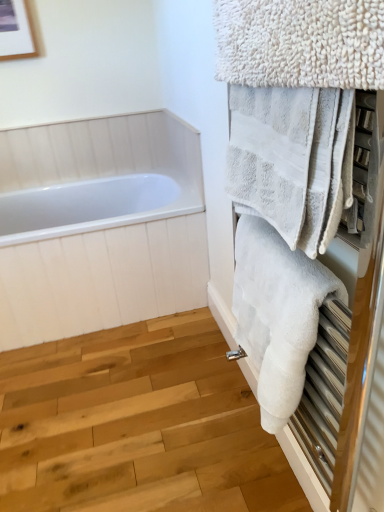
Question: From their relative heights in the image, would you say white fluffy towel at upper right, marked as the third towel in a bottom-to-top arrangement, is taller or shorter than white fluffy towel at right, placed as the 1th towel when sorted from bottom to top?

Choices:
 (A) short
 (B) tall

Answer: (A)

Question: Is white fluffy towel at upper right, marked as the third towel in a bottom-to-top arrangement, wider or thinner than white fluffy towel at right, placed as the 1th towel when sorted from bottom to top?

Choices:
 (A) thin
 (B) wide

Answer: (A)

Question: Which object is positioned closest to the white glossy bathtub at left?

Choices:
 (A) white fluffy towel at right, placed as the 1th towel when sorted from bottom to top
 (B) white fluffy towel at upper right, marked as the second towel in a bottom-to-top arrangement
 (C) white fluffy towel at upper right, placed as the first towel when sorted from top to bottom

Answer: (A)

Question: Considering the real-world distances, which object is farthest from the white fluffy towel at upper right, marked as the second towel in a bottom-to-top arrangement?

Choices:
 (A) white glossy bathtub at left
 (B) white fluffy towel at upper right, placed as the first towel when sorted from top to bottom
 (C) white fluffy towel at right, placed as the 1th towel when sorted from bottom to top

Answer: (A)